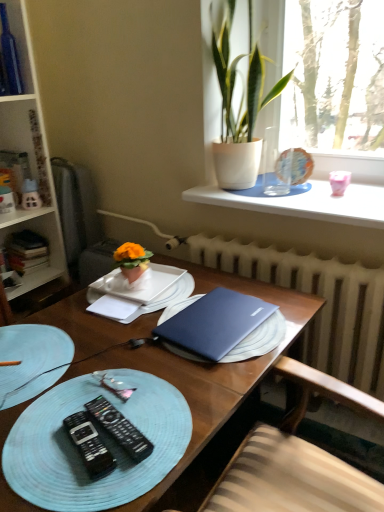
The width and height of the screenshot is (384, 512). I want to click on unoccupied space behind black plastic remote control at lower left, which ranks as the second remote control in left-to-right order, so click(129, 381).